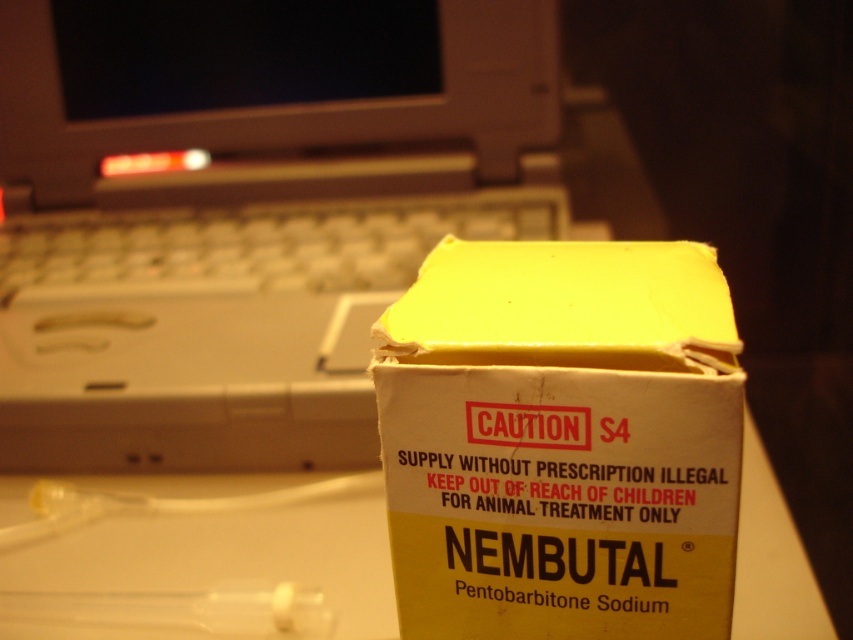
Based on the photo, is yellow cardboard box at center positioned before white plastic keyboard at upper left?

Yes, yellow cardboard box at center is closer to the viewer.

Which is in front, point (611, 292) or point (91, 246)?

Point (611, 292)

This screenshot has width=853, height=640. I want to click on yellow cardboard box at center, so click(x=561, y=440).

Is white plastic laptop at center wider than white plastic keyboard at upper left?

Indeed, white plastic laptop at center has a greater width compared to white plastic keyboard at upper left.

At what (x,y) coordinates should I click in order to perform the action: click on white plastic laptop at center. Please return your answer as a coordinate pair (x, y). This screenshot has height=640, width=853. Looking at the image, I should click on (242, 211).

This screenshot has height=640, width=853. I want to click on white plastic laptop at center, so click(242, 211).

Looking at this image, is white plastic laptop at center to the right of yellow cardboard box at center from the viewer's perspective?

Incorrect, white plastic laptop at center is not on the right side of yellow cardboard box at center.

Does white plastic laptop at center have a greater width compared to yellow cardboard box at center?

Yes, white plastic laptop at center is wider than yellow cardboard box at center.

The image size is (853, 640). What are the coordinates of `white plastic laptop at center` in the screenshot? It's located at (242, 211).